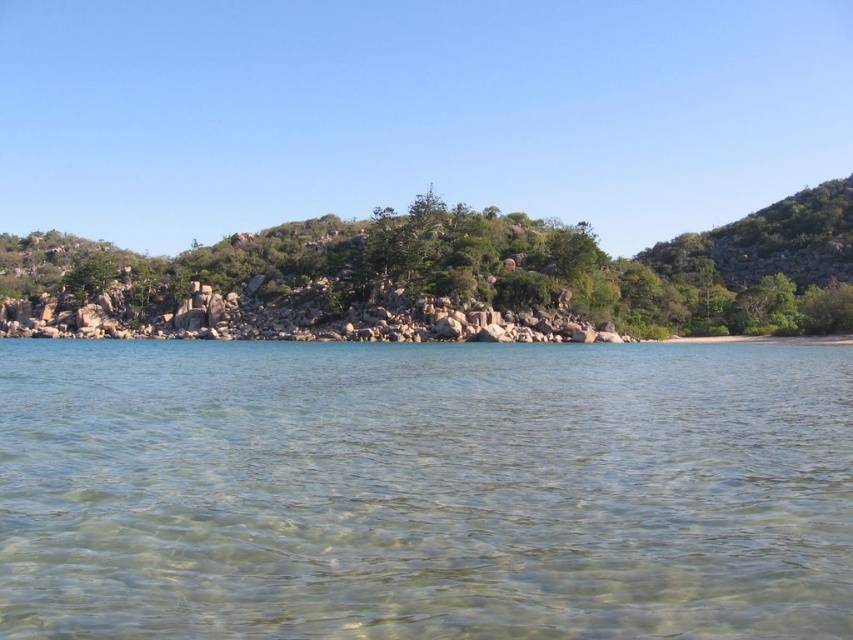
Question: Considering the relative positions of clear water at center and green textured rocks at center in the image provided, where is clear water at center located with respect to green textured rocks at center?

Choices:
 (A) above
 (B) below

Answer: (B)

Question: Which point is closer to the camera?

Choices:
 (A) (827, 273)
 (B) (204, 522)

Answer: (B)

Question: Where is clear water at center located in relation to green textured rocks at center in the image?

Choices:
 (A) right
 (B) left

Answer: (B)

Question: Observing the image, what is the correct spatial positioning of clear water at center in reference to green textured rocks at center?

Choices:
 (A) left
 (B) right

Answer: (A)

Question: Among these objects, which one is farthest from the camera?

Choices:
 (A) green textured rocks at center
 (B) clear water at center

Answer: (A)